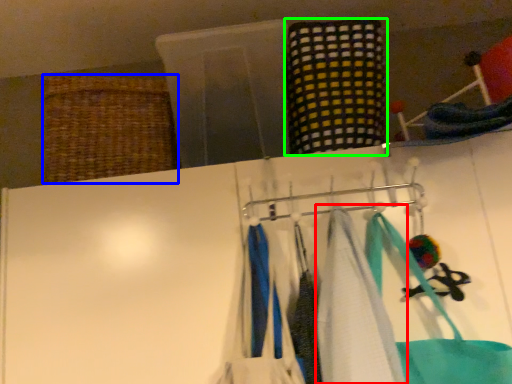
Question: Considering the real-world distances, which object is closest to towel (highlighted by a red box)? basket (highlighted by a blue box) or clothing (highlighted by a green box).

Choices:
 (A) basket
 (B) clothing

Answer: (B)